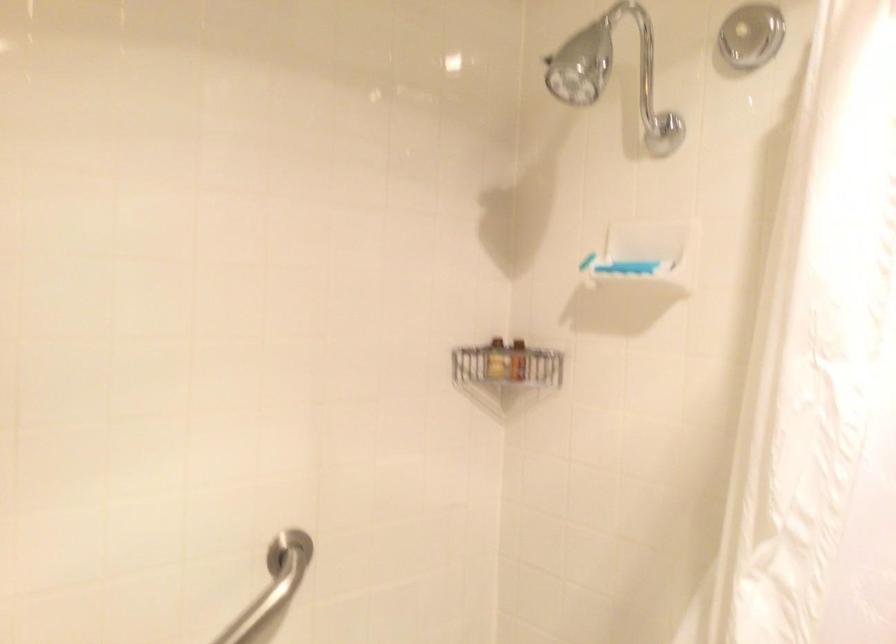
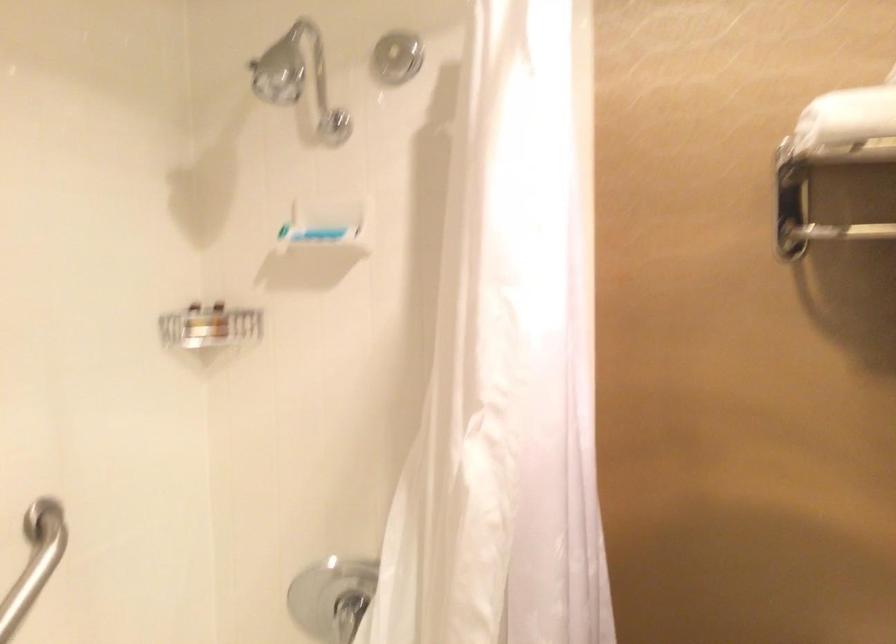
In the second image, find the point that corresponds to the point at 625,266 in the first image.

(316, 234)